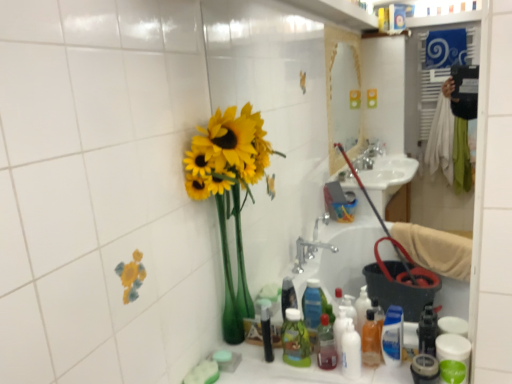
Question: From the image's perspective, relative to blue glossy bottle at lower right, acting as the 1th cleaning product starting from the right, is green plastic bottle at lower center above or below?

Choices:
 (A) below
 (B) above

Answer: (A)

Question: In terms of width, does green plastic bottle at lower center look wider or thinner when compared to blue glossy bottle at lower right, positioned as the second cleaning product in left-to-right order?

Choices:
 (A) wide
 (B) thin

Answer: (A)

Question: Which is nearer to the green plastic bottle at lower center?

Choices:
 (A) white glossy bottle at lower center, arranged as the 2th cleaning product when viewed from the right
 (B) translucent orange bottle at lower center, which is the first bottle from right to left
 (C) yellow matte sunflowers at left
 (D) black plastic toothbrush at lower center, which is the 3th bottle in right-to-left order
 (E) blue glossy bottle at lower right, acting as the 1th cleaning product starting from the right

Answer: (D)

Question: Considering the real-world distances, which object is closest to the blue glossy bottle at lower right, positioned as the second cleaning product in left-to-right order?

Choices:
 (A) black plastic toothbrush at lower center, which is the 3th bottle in right-to-left order
 (B) translucent plastic bottle at center, which appears as the second bottle when viewed from the left
 (C) white glossy bottle at lower center, arranged as the 2th cleaning product when viewed from the right
 (D) green plastic bottle at lower center
 (E) translucent orange bottle at lower center, which is the first bottle from right to left

Answer: (E)